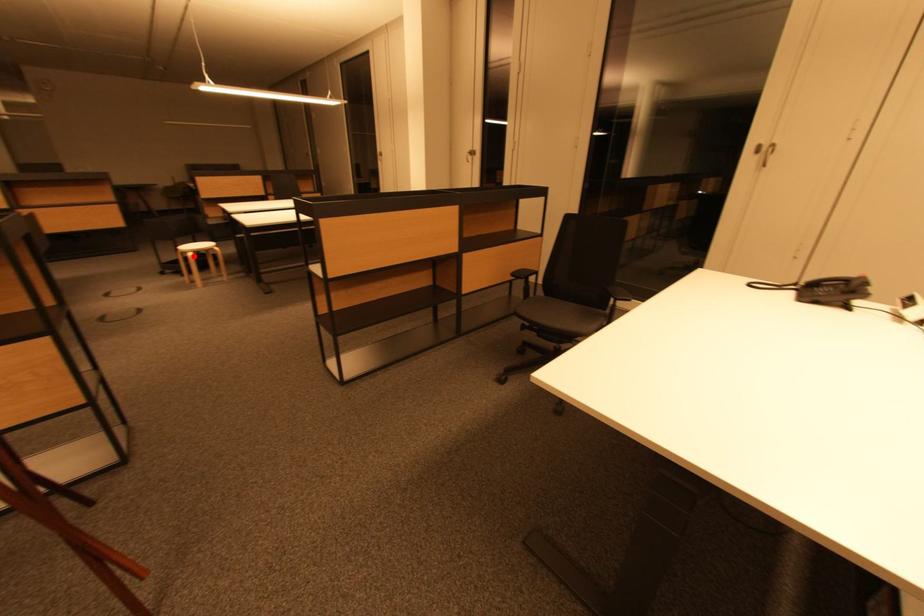
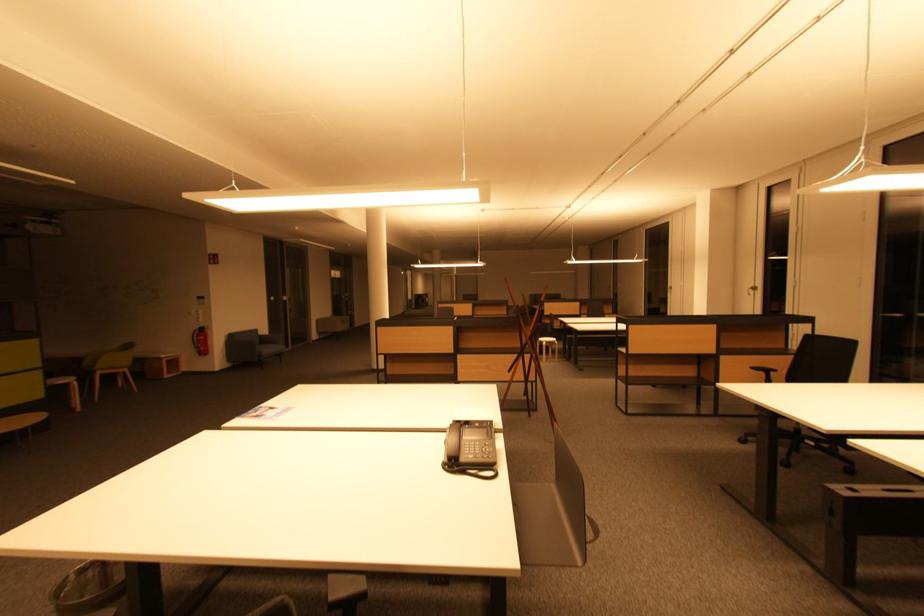
Question: A red point is marked in image1. In image2, is the corresponding 3D point closer to the camera or farther? Reply with the corresponding letter.

Choices:
 (A) The corresponding 3D point is closer.
 (B) The corresponding 3D point is farther.

Answer: (B)